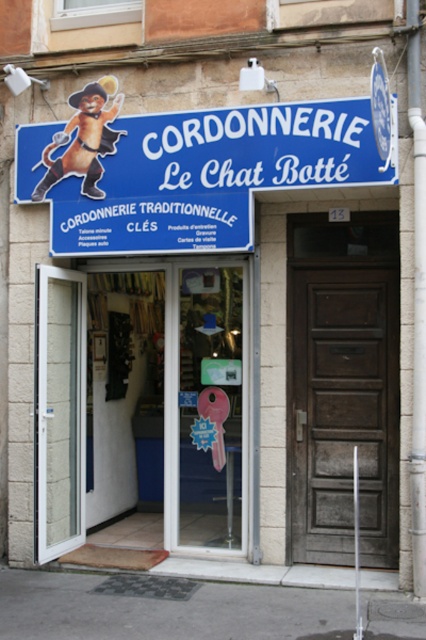
You are a delivery person trying to deliver a package to the cordonnier shop. You see a dark wood door at center and a white plastic door at left. Which door should you use to enter the shop?

The dark wood door at center is the correct entrance to the cordonnier shop since it is centrally located and part of the storefront signage, while the white plastic door at left might be a service entrance or another type of access point not intended for customers.

You are a customer arriving at the Cordonnerie Le Chat Bottet shop and need to enter. Which door should you use, the dark wood door at center or the white plastic door at left?

The dark wood door at center is located above the white plastic door at left. Since the white plastic door at left is lower, it is more likely to be the entrance for customers. Therefore, you should use the white plastic door at left to enter the shop.

You are standing in front of the Cordonnerie Le Chat Bott shop and want to take a photo. You notice two points marked on the sign. The first point is at coordinate point [353,237] and the second is at point [54,516]. Which point will appear larger in your photo?

Point [353,237] will appear larger in the photo because it is closer to the camera than point [54,516].